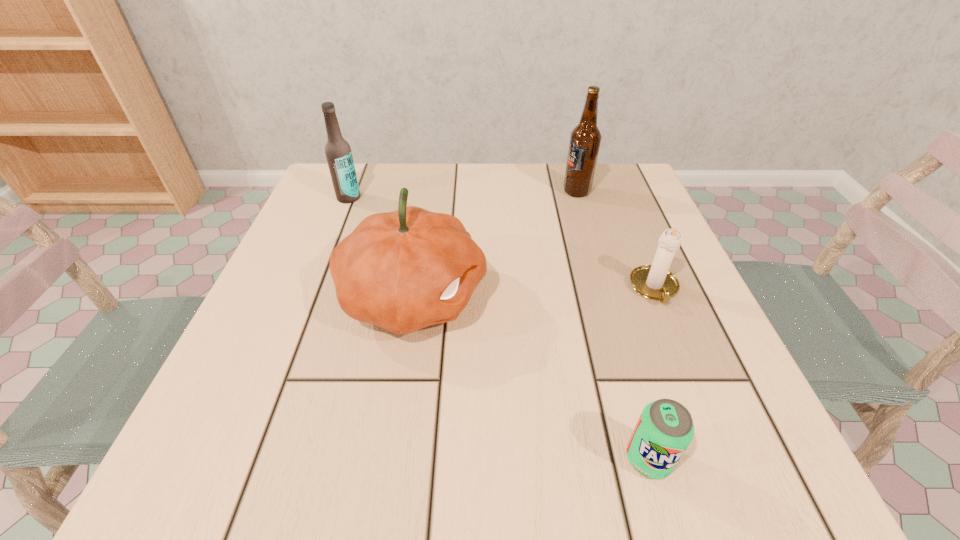
This screenshot has width=960, height=540. In order to click on object situated at the far right corner in this screenshot , I will do `click(585, 139)`.

Image resolution: width=960 pixels, height=540 pixels. Identify the location of object positioned at the near right corner. (665, 428).

In the image, there is a desktop. Where is `vacant space at the far edge`? vacant space at the far edge is located at coordinates (439, 198).

I want to click on vacant position at the near edge of the desktop, so click(x=554, y=424).

This screenshot has height=540, width=960. In order to click on free point at the left edge in this screenshot , I will do `click(295, 398)`.

You are a GUI agent. You are given a task and a screenshot of the screen. Output one action in this format:
    pyautogui.click(x=<x>, y=<y>)
    Task: Click on the free space at the right edge
    The image size is (960, 540).
    Given the screenshot: What is the action you would take?
    pyautogui.click(x=639, y=323)

The height and width of the screenshot is (540, 960). Find the location of `free space at the far right corner of the desktop`. free space at the far right corner of the desktop is located at coordinates (633, 209).

At what (x,y) coordinates should I click in order to perform the action: click on vacant area that lies between the leftmost object and the pop soda. Please return your answer as a coordinate pair (x, y). This screenshot has width=960, height=540. Looking at the image, I should click on tap(498, 328).

What are the coordinates of `vacant area between the pumpkin and the nearest object` in the screenshot? It's located at (531, 378).

What are the coordinates of `empty location between the pumpkin and the second shortest object` in the screenshot? It's located at (534, 293).